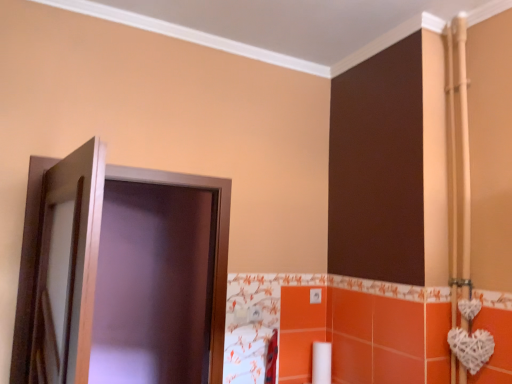
Describe the element at coordinates (321, 362) in the screenshot. I see `white matte toilet paper at lower right` at that location.

You are a GUI agent. You are given a task and a screenshot of the screen. Output one action in this format:
    pyautogui.click(x=<x>, y=<y>)
    Task: Click on the white matte toilet paper at lower right
    This screenshot has height=384, width=512.
    Given the screenshot: What is the action you would take?
    pyautogui.click(x=321, y=362)

Find the location of `white matte toilet paper at lower right`. white matte toilet paper at lower right is located at coordinates (321, 362).